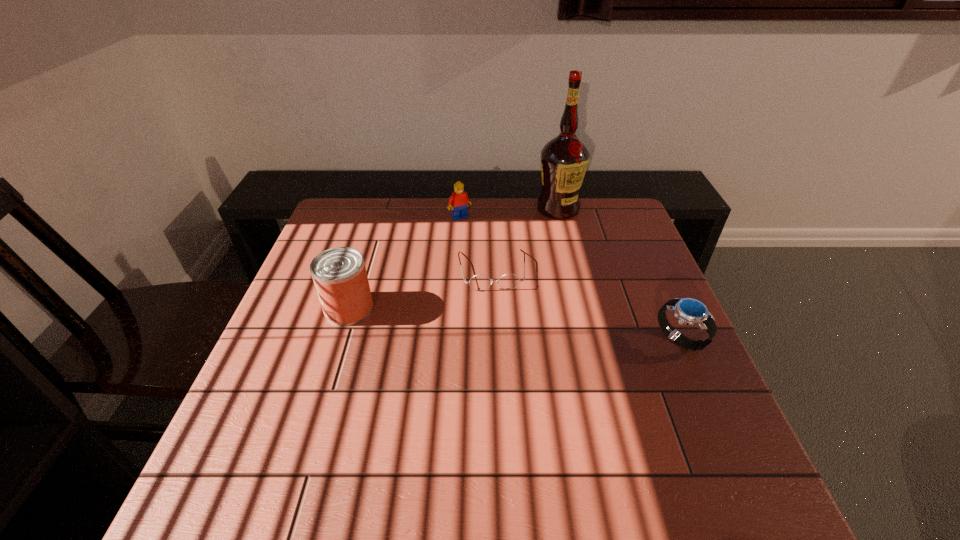
You are a GUI agent. You are given a task and a screenshot of the screen. Output one action in this format:
    pyautogui.click(x=<x>, y=<y>)
    Task: Click on the can
    
    Given the screenshot: What is the action you would take?
    pyautogui.click(x=339, y=274)

This screenshot has height=540, width=960. Identify the location of the leftmost object. (339, 274).

Find the location of a particular element. the fourth tallest object is located at coordinates (689, 311).

The image size is (960, 540). In order to click on the rightmost object in this screenshot , I will do `click(689, 311)`.

At what (x,y) coordinates should I click in order to perform the action: click on the fourth object from left to right. Please return your answer as a coordinate pair (x, y). The image size is (960, 540). Looking at the image, I should click on (564, 160).

The image size is (960, 540). Find the location of `the tallest object`. the tallest object is located at coordinates (564, 160).

Where is `the shortest object`? the shortest object is located at coordinates (509, 281).

Locate an element on the screen. the third farthest object is located at coordinates (509, 281).

At what (x,y) coordinates should I click in order to perform the action: click on the third tallest object. Please return your answer as a coordinate pair (x, y). Looking at the image, I should click on (458, 201).

Image resolution: width=960 pixels, height=540 pixels. In order to click on vacant area situated 0.100m on the left of the can in this screenshot , I will do `click(286, 308)`.